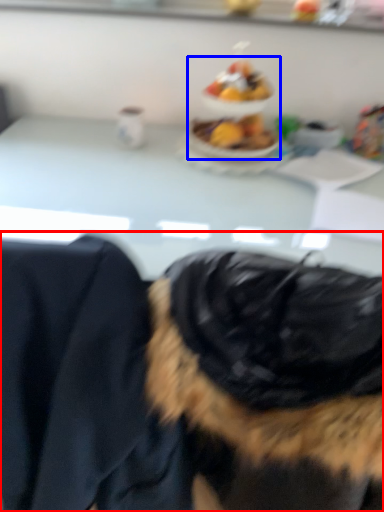
Question: Which point is further to the camera, dog (highlighted by a red box) or food (highlighted by a blue box)?

Choices:
 (A) dog
 (B) food

Answer: (B)